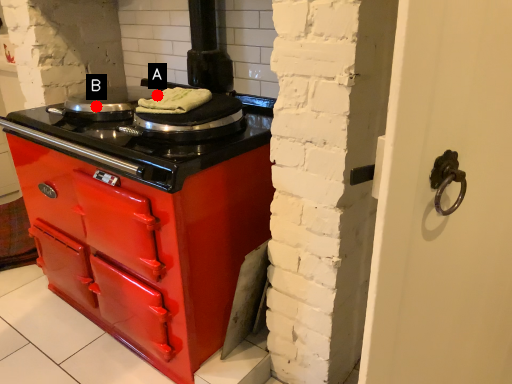
Question: Two points are circled on the image, labeled by A and B beside each circle. Which point is farther to the camera?

Choices:
 (A) A is further
 (B) B is further

Answer: (B)